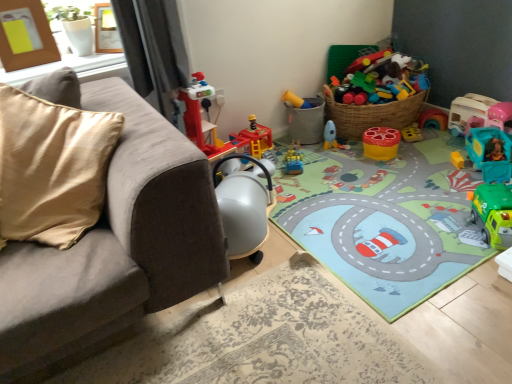
Question: Can you confirm if carpeted play mat at center is bigger than matte plastic bucket at center, marked as the 2th toy in a left-to-right arrangement?

Choices:
 (A) no
 (B) yes

Answer: (B)

Question: Is carpeted play mat at center closer to camera compared to matte plastic bucket at center, the 5th toy when ordered from right to left?

Choices:
 (A) yes
 (B) no

Answer: (A)

Question: Is the position of carpeted play mat at center more distant than that of matte plastic bucket at center, the 5th toy when ordered from right to left?

Choices:
 (A) no
 (B) yes

Answer: (A)

Question: Would you say carpeted play mat at center contains matte plastic bucket at center, the 5th toy when ordered from right to left?

Choices:
 (A) no
 (B) yes

Answer: (A)

Question: From a real-world perspective, is carpeted play mat at center physically below matte plastic bucket at center, marked as the 2th toy in a left-to-right arrangement?

Choices:
 (A) yes
 (B) no

Answer: (A)

Question: From a real-world perspective, is carpeted play mat at center over matte plastic bucket at center, the 5th toy when ordered from right to left?

Choices:
 (A) yes
 (B) no

Answer: (B)

Question: Can you confirm if carpeted play mat at center is wider than yellow matte stool at center, arranged as the 3th toy when viewed from the left?

Choices:
 (A) yes
 (B) no

Answer: (A)

Question: Is carpeted play mat at center facing away from yellow matte stool at center, arranged as the 3th toy when viewed from the left?

Choices:
 (A) yes
 (B) no

Answer: (B)

Question: Is the surface of carpeted play mat at center in direct contact with yellow matte stool at center, placed as the fourth toy when sorted from right to left?

Choices:
 (A) yes
 (B) no

Answer: (B)

Question: Is carpeted play mat at center to the left of yellow matte stool at center, arranged as the 3th toy when viewed from the left, from the viewer's perspective?

Choices:
 (A) no
 (B) yes

Answer: (B)

Question: Are carpeted play mat at center and yellow matte stool at center, placed as the fourth toy when sorted from right to left, far apart?

Choices:
 (A) yes
 (B) no

Answer: (B)

Question: Does carpeted play mat at center have a smaller size compared to yellow matte stool at center, placed as the fourth toy when sorted from right to left?

Choices:
 (A) no
 (B) yes

Answer: (A)

Question: Is wooden photo frame at upper center, positioned as the 2th picture frame in left-to-right order, with teal plastic toy car at right, placed as the fifth toy when sorted from left to right?

Choices:
 (A) yes
 (B) no

Answer: (B)